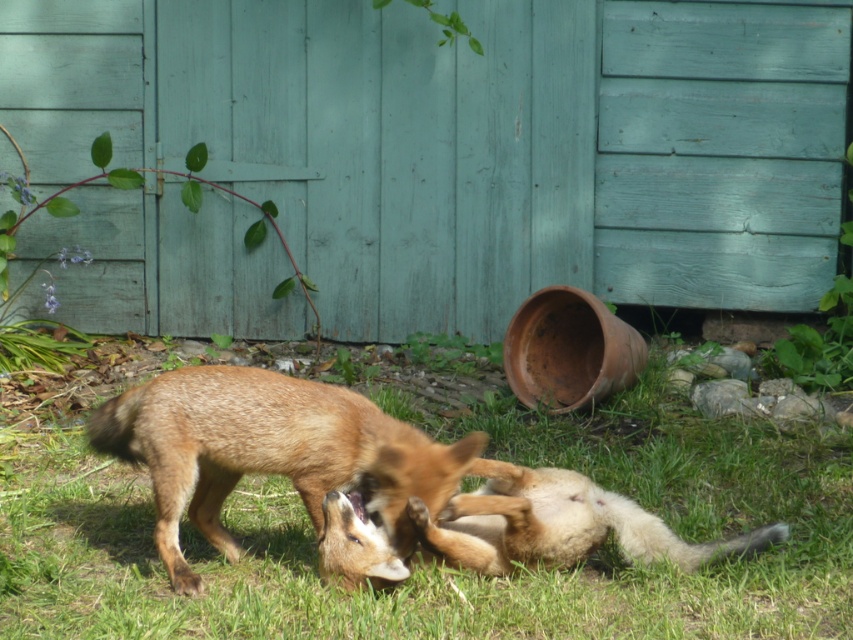
Is green grass at lower center positioned at the back of golden fur fox at center?

No, green grass at lower center is closer to the viewer.

Who is lower down, green grass at lower center or golden fur fox at center?

green grass at lower center is below.

Does point (724, 504) come behind point (399, 532)?

Yes, point (724, 504) is farther from viewer.

This screenshot has width=853, height=640. I want to click on green grass at lower center, so click(x=450, y=568).